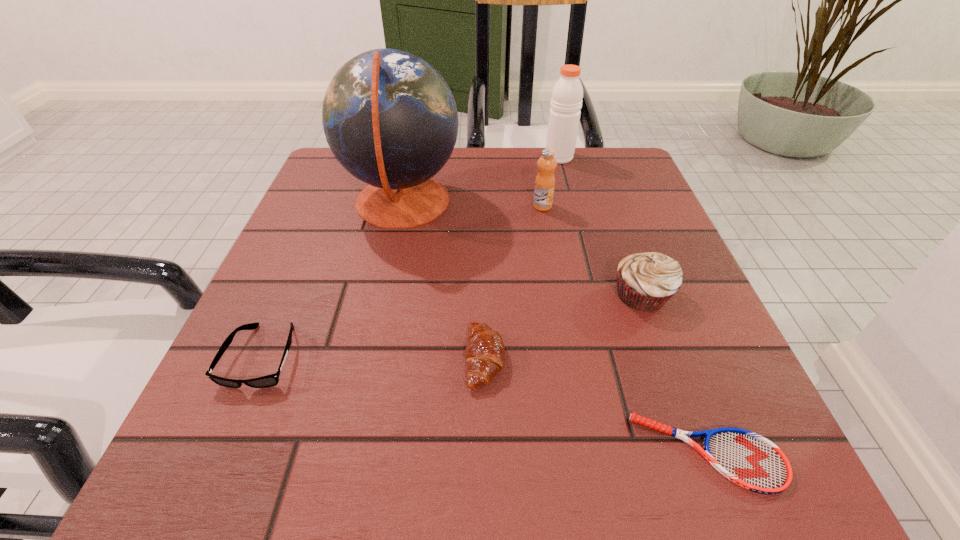
The width and height of the screenshot is (960, 540). Identify the location of the nearest object. (748, 459).

This screenshot has width=960, height=540. What are the coordinates of `the shortest object` in the screenshot? It's located at (748, 459).

In order to click on vacant region located with the Americas facing the viewer on the globe in this screenshot , I will do `click(489, 204)`.

Locate an element on the screen. This screenshot has height=540, width=960. free space located 0.350m on the left of the shaker is located at coordinates click(405, 157).

Where is `free space located 0.400m on the front label of the fourth object from left to right`? The image size is (960, 540). free space located 0.400m on the front label of the fourth object from left to right is located at coordinates (571, 370).

I want to click on free region located on the back of the muffin, so click(x=617, y=226).

Image resolution: width=960 pixels, height=540 pixels. I want to click on free region located 0.340m on the back of the third shortest object, so click(x=484, y=206).

Locate an element on the screen. The image size is (960, 540). vacant region located 0.110m on the front-facing side of the sunglasses is located at coordinates click(213, 471).

I want to click on free location located 0.140m on the back of the shortest object, so click(663, 334).

The height and width of the screenshot is (540, 960). Identify the location of globe located in the far edge section of the desktop. (390, 119).